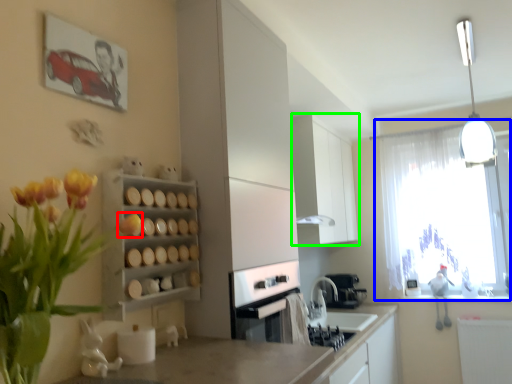
Question: Based on their relative distances, which object is farther from flower (highlighted by a red box)? Choose from window (highlighted by a blue box) and cabinetry (highlighted by a green box).

Choices:
 (A) window
 (B) cabinetry

Answer: (A)